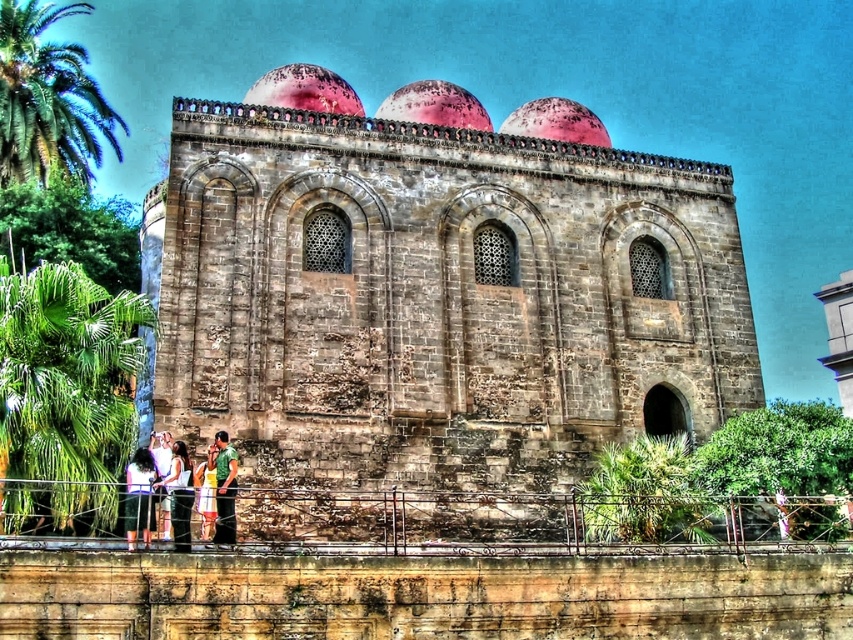
You are standing at the base of the stone church at center and want to greet the person wearing the yellow cotton dress at lower center. Which direction should you walk to get closer to them?

You should walk away from the stone church at center because the yellow cotton dress at lower center is closer to you than the stone church at center, so moving away from the church will bring you closer to the person in the yellow cotton dress.

You are a photographer trying to capture the stone church at center and the white cotton dress at lower center in the same frame. Based on their sizes, which object would appear larger in your photo?

The stone church at center would appear larger in the photo because it has a greater height compared to the white cotton dress at lower center.